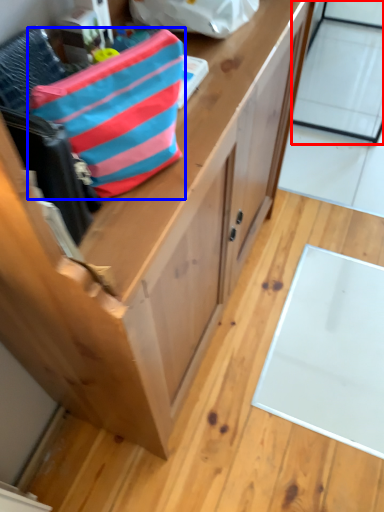
Question: Which of the following is the closest to the observer, glass door (highlighted by a red box) or pouch (highlighted by a blue box)?

Choices:
 (A) glass door
 (B) pouch

Answer: (B)